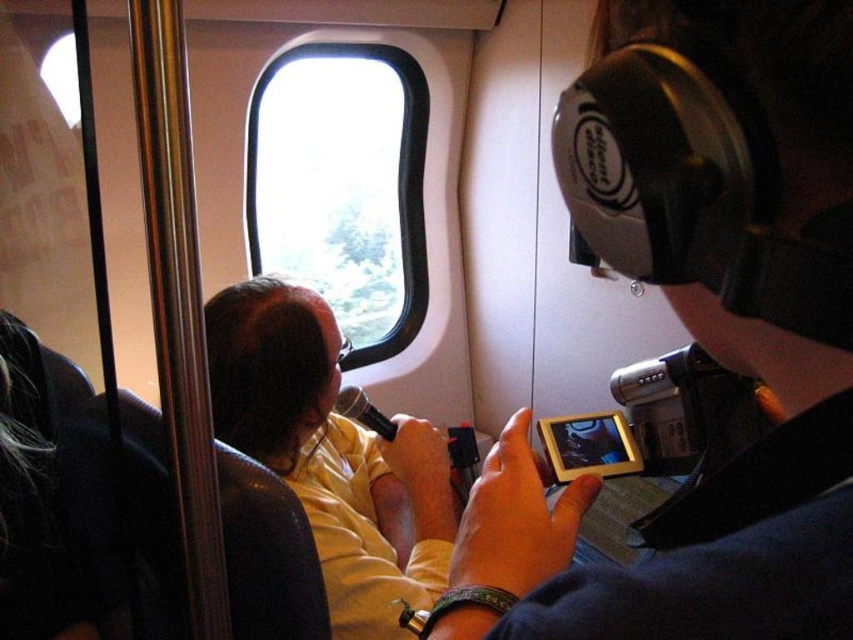
Is silent disco headphones at upper right positioned behind transparent glass airplane window at upper center?

No, it is in front of transparent glass airplane window at upper center.

Between point (601, 29) and point (398, 109), which one is positioned in front?

Positioned in front is point (601, 29).

Who is more forward, (688, 611) or (322, 173)?

Positioned in front is point (688, 611).

Find the location of a particular element. The image size is (853, 640). silent disco headphones at upper right is located at coordinates (653, 563).

Does yellow matte shirt at center have a greater height compared to transparent glass airplane window at upper center?

Incorrect, yellow matte shirt at center's height is not larger of transparent glass airplane window at upper center's.

From the picture: Is the position of yellow matte shirt at center more distant than that of transparent glass airplane window at upper center?

No, yellow matte shirt at center is closer to the viewer.

The height and width of the screenshot is (640, 853). In order to click on yellow matte shirt at center in this screenshot , I will do `click(331, 456)`.

Where is `yellow matte shirt at center`? This screenshot has width=853, height=640. yellow matte shirt at center is located at coordinates (331, 456).

Does silent disco headphones at upper right have a smaller size compared to yellow matte shirt at center?

Indeed, silent disco headphones at upper right has a smaller size compared to yellow matte shirt at center.

Is silent disco headphones at upper right thinner than yellow matte shirt at center?

Yes.

Between point (776, 620) and point (381, 445), which one is positioned in front?

Point (776, 620)

Where is `silent disco headphones at upper right`? This screenshot has height=640, width=853. silent disco headphones at upper right is located at coordinates (653, 563).